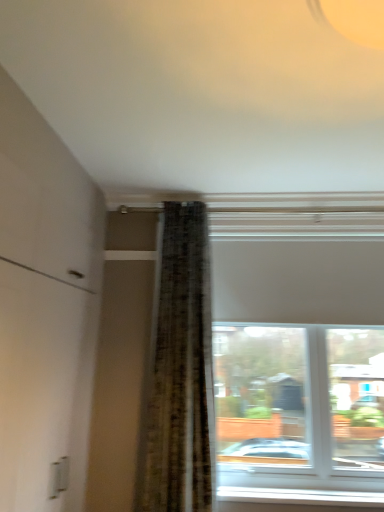
Question: Would you say white matte window at upper center is outside white plastic window sill at lower center?

Choices:
 (A) no
 (B) yes

Answer: (B)

Question: Is white matte window at upper center further to the viewer compared to white plastic window sill at lower center?

Choices:
 (A) yes
 (B) no

Answer: (B)

Question: Is white plastic window sill at lower center a part of white matte window at upper center?

Choices:
 (A) no
 (B) yes

Answer: (B)

Question: From a real-world perspective, is white matte window at upper center positioned under white plastic window sill at lower center based on gravity?

Choices:
 (A) no
 (B) yes

Answer: (A)

Question: Is white matte window at upper center oriented towards white plastic window sill at lower center?

Choices:
 (A) yes
 (B) no

Answer: (B)

Question: Is white matte window at upper center taller than white plastic window sill at lower center?

Choices:
 (A) yes
 (B) no

Answer: (A)

Question: Considering the relative sizes of white plastic window sill at lower center and white matte window at upper center in the image provided, is white plastic window sill at lower center taller than white matte window at upper center?

Choices:
 (A) yes
 (B) no

Answer: (B)

Question: From a real-world perspective, is white plastic window sill at lower center located beneath white matte window at upper center?

Choices:
 (A) no
 (B) yes

Answer: (B)

Question: Is white plastic window sill at lower center not inside white matte window at upper center?

Choices:
 (A) no
 (B) yes

Answer: (A)

Question: Is white plastic window sill at lower center beside white matte window at upper center?

Choices:
 (A) yes
 (B) no

Answer: (B)

Question: Is white plastic window sill at lower center positioned far away from white matte window at upper center?

Choices:
 (A) no
 (B) yes

Answer: (A)

Question: Is the position of white plastic window sill at lower center more distant than that of white matte window at upper center?

Choices:
 (A) yes
 (B) no

Answer: (A)

Question: Is point (223, 490) positioned closer to the camera than point (375, 472)?

Choices:
 (A) closer
 (B) farther

Answer: (A)